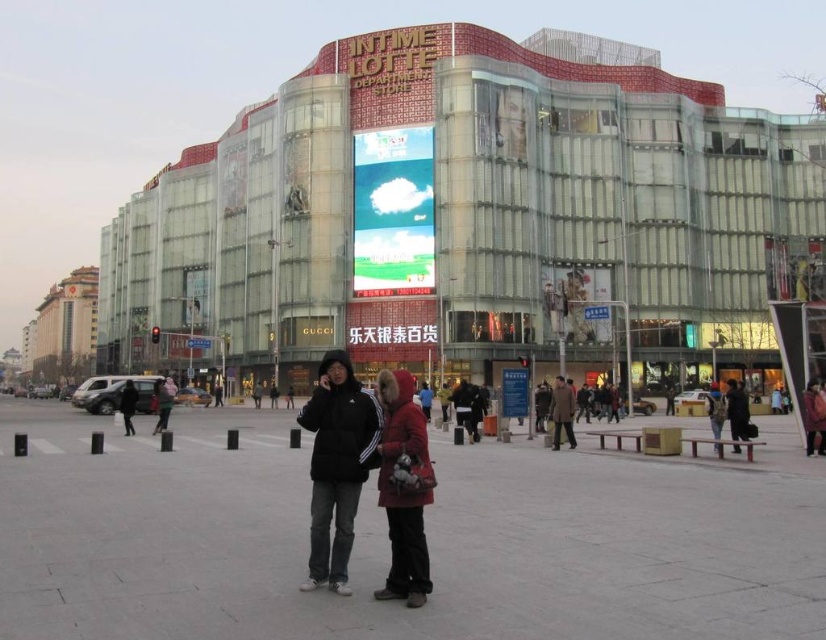
You are standing in the middle of the smooth concrete plaza at center and want to reach the brown wool coat at center. Which direction should you move to get there?

The smooth concrete plaza at center is on the left side of the brown wool coat at center, so you should move to the right to reach it.